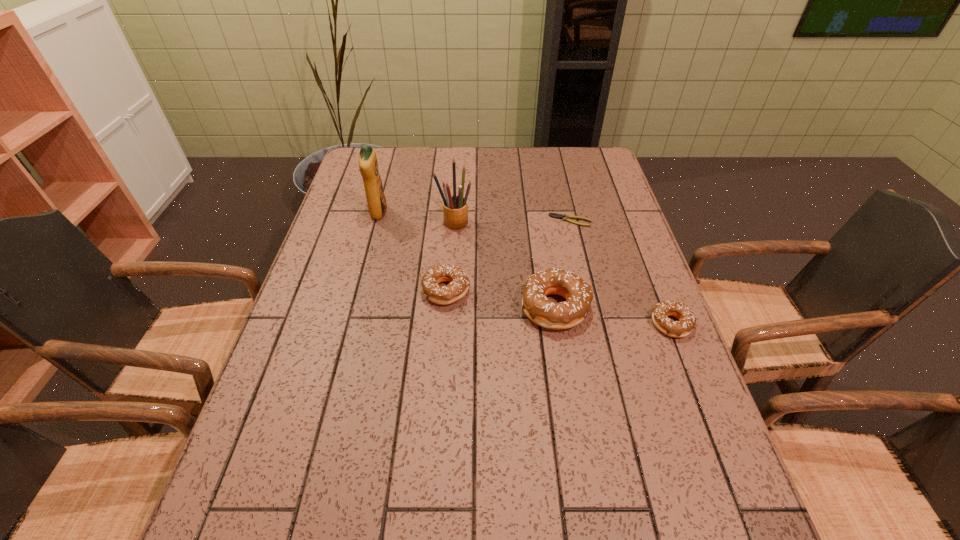
You are a GUI agent. You are given a task and a screenshot of the screen. Output one action in this format:
    pyautogui.click(x=<x>, y=<y>)
    Task: Click on the vacant region located 0.320m on the back of the second shortest doughnut
    The height and width of the screenshot is (540, 960).
    Given the screenshot: What is the action you would take?
    pyautogui.click(x=452, y=204)

The height and width of the screenshot is (540, 960). Find the location of `free space located 0.190m on the left of the second doughnut from right to left`. free space located 0.190m on the left of the second doughnut from right to left is located at coordinates (444, 307).

Where is `vacant space located 0.270m on the back of the second shortest object`? vacant space located 0.270m on the back of the second shortest object is located at coordinates (638, 239).

The width and height of the screenshot is (960, 540). Identify the location of vacant point located on the back of the second tallest object. (457, 181).

This screenshot has height=540, width=960. Identify the location of free space located 0.330m on the label of the tallest object. (492, 213).

Image resolution: width=960 pixels, height=540 pixels. Identify the location of free location located on the left of the shortest object. (442, 220).

You are a GUI agent. You are given a task and a screenshot of the screen. Output one action in this format:
    pyautogui.click(x=<x>, y=<y>)
    Task: Click on the object that is positioned at the left edge
    This screenshot has height=540, width=960.
    Given the screenshot: What is the action you would take?
    pyautogui.click(x=368, y=165)

Where is `doughnut that is at the right edge`? doughnut that is at the right edge is located at coordinates (683, 327).

Where is `pliers located in the right edge section of the desktop`? pliers located in the right edge section of the desktop is located at coordinates (564, 217).

This screenshot has height=540, width=960. Find the location of `blank space at the far edge of the desktop`. blank space at the far edge of the desktop is located at coordinates (444, 154).